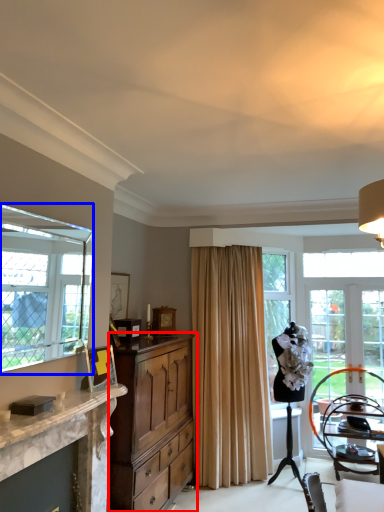
Question: Which point is closer to the camera, cabinetry (highlighted by a red box) or window (highlighted by a blue box)?

Choices:
 (A) cabinetry
 (B) window

Answer: (B)